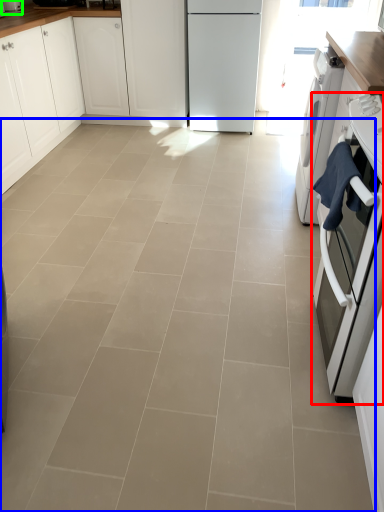
Question: Which object is positioned closest to home appliance (highlighted by a red box)? Select from ceramic tile (highlighted by a blue box) and kitchen appliance (highlighted by a green box).

Choices:
 (A) ceramic tile
 (B) kitchen appliance

Answer: (A)